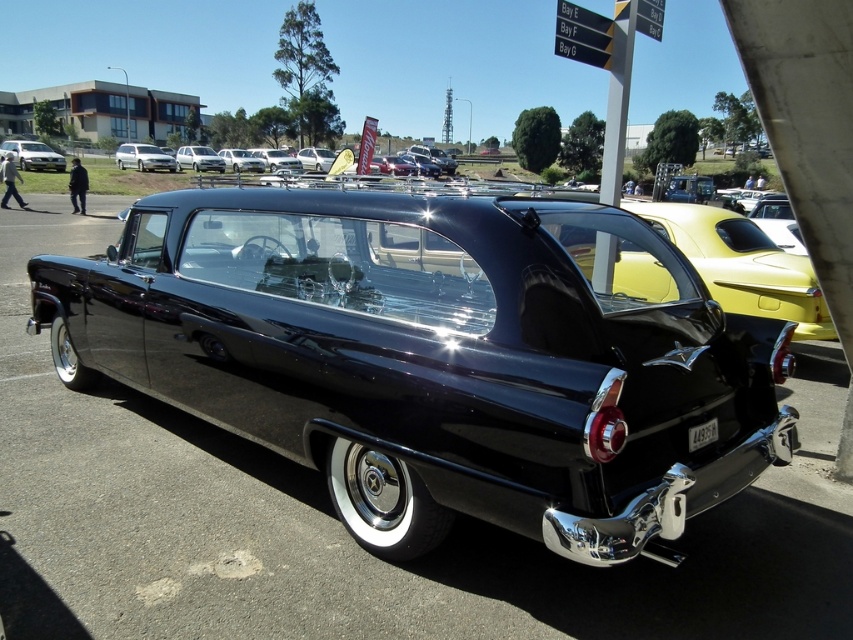
Can you confirm if matte white car at upper left is positioned to the left of white glossy sedan at upper left?

Yes, matte white car at upper left is to the left of white glossy sedan at upper left.

Does matte white car at upper left appear under white glossy sedan at upper left?

Actually, matte white car at upper left is above white glossy sedan at upper left.

Identify the location of matte white car at upper left. (32, 154).

The width and height of the screenshot is (853, 640). Find the location of `matte white car at upper left`. matte white car at upper left is located at coordinates (32, 154).

Is matte white car at upper left thinner than shiny silver sedan at center?

No, matte white car at upper left is not thinner than shiny silver sedan at center.

Can you confirm if matte white car at upper left is bigger than shiny silver sedan at center?

Yes, matte white car at upper left is bigger than shiny silver sedan at center.

Between point (48, 161) and point (183, 156), which one is positioned behind?

The point (183, 156) is more distant.

Locate an element on the screen. matte white car at upper left is located at coordinates (32, 154).

Does white glossy sedan at upper left have a lesser width compared to shiny silver sedan at center?

No, white glossy sedan at upper left is not thinner than shiny silver sedan at center.

Is the position of white glossy sedan at upper left more distant than that of shiny silver sedan at center?

No.

Is point (138, 156) more distant than point (180, 156)?

No, it is in front of (180, 156).

The image size is (853, 640). I want to click on white glossy sedan at upper left, so click(x=143, y=157).